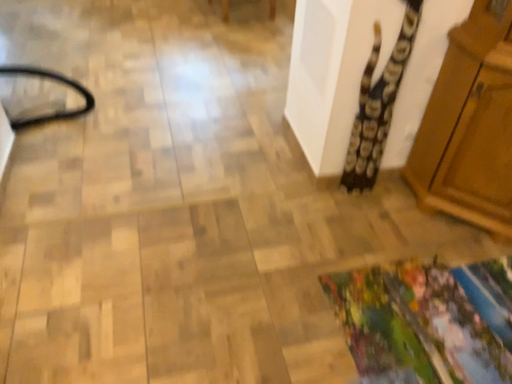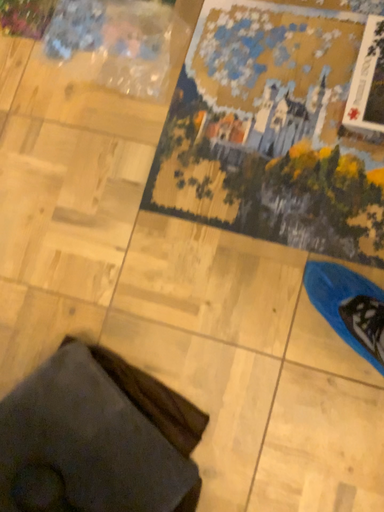
Question: How did the camera likely rotate when shooting the video?

Choices:
 (A) rotated upward
 (B) rotated downward

Answer: (B)